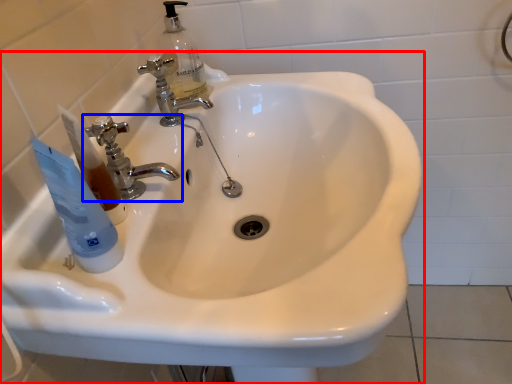
Question: Which of the following is the farthest to the observer, sink (highlighted by a red box) or tap (highlighted by a blue box)?

Choices:
 (A) sink
 (B) tap

Answer: (B)